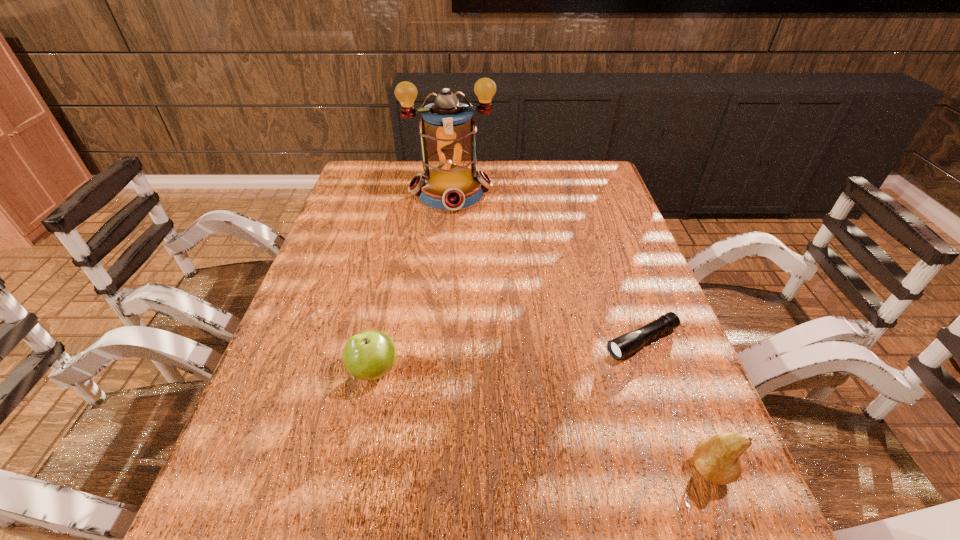
Identify the location of vacant area that lies between the nearest object and the apple. (542, 420).

In order to click on free space between the shortest object and the nearest object in this screenshot , I will do `click(676, 406)`.

In order to click on empty space that is in between the tallest object and the shortest object in this screenshot , I will do `click(546, 266)`.

The image size is (960, 540). I want to click on object that is the third nearest to the shortest object, so click(x=447, y=132).

Locate an element on the screen. Image resolution: width=960 pixels, height=540 pixels. object that stands as the third closest to the lantern is located at coordinates (718, 458).

You are a GUI agent. You are given a task and a screenshot of the screen. Output one action in this format:
    pyautogui.click(x=<x>, y=<y>)
    Task: Click on the free space that satisfies the following two spatial constraints: 1. on the front side of the apple; 2. on the left side of the nearest object
    
    Given the screenshot: What is the action you would take?
    pyautogui.click(x=352, y=470)

Identify the location of vacant region that satisfies the following two spatial constraints: 1. on the back side of the apple; 2. on the left side of the lantern. click(413, 191).

You are a GUI agent. You are given a task and a screenshot of the screen. Output one action in this format:
    pyautogui.click(x=<x>, y=<y>)
    Task: Click on the vacant area that satisfies the following two spatial constraints: 1. on the back side of the shortest object; 2. on the right side of the apple
    
    Given the screenshot: What is the action you would take?
    pyautogui.click(x=380, y=341)